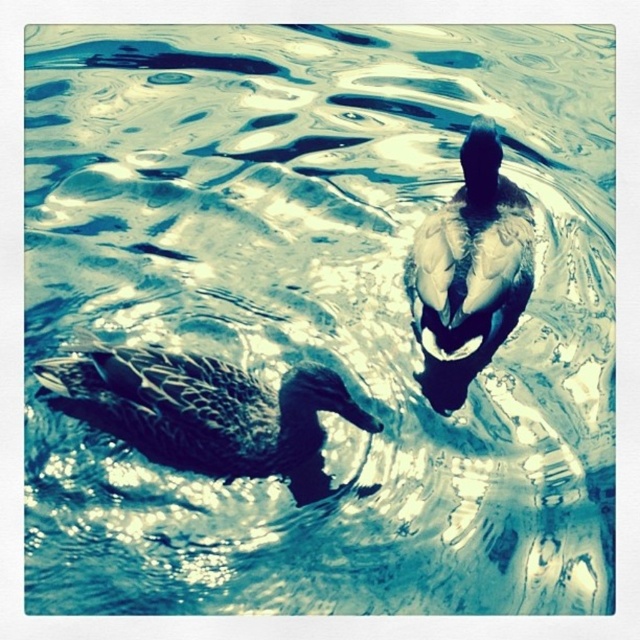
Which of these two, dark brown feathers duck at lower left or dark brown feathers at upper center, stands shorter?

dark brown feathers duck at lower left

Identify the location of dark brown feathers duck at lower left. This screenshot has width=640, height=640. tap(204, 410).